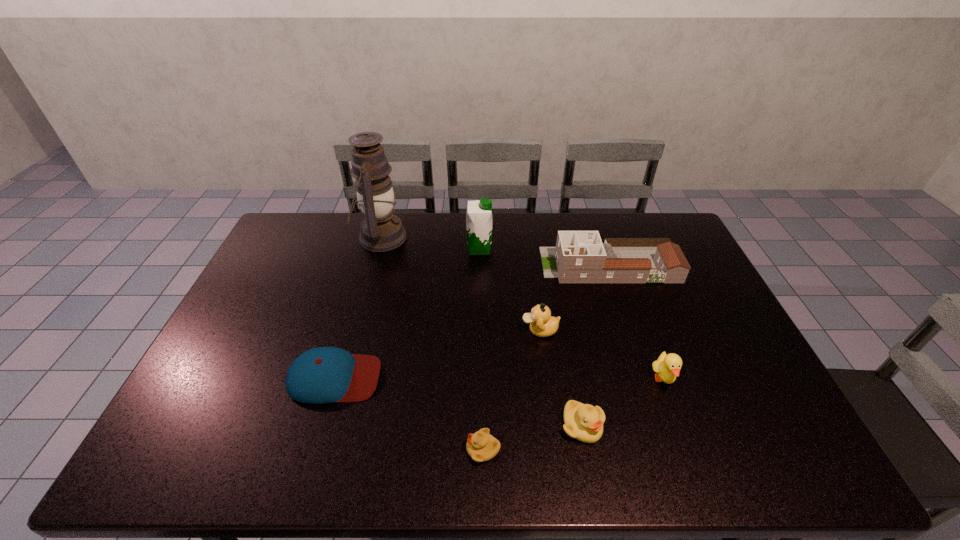
Identify the location of oil lamp. Image resolution: width=960 pixels, height=540 pixels. (381, 230).

Where is `the seventh shortest object`? This screenshot has width=960, height=540. the seventh shortest object is located at coordinates (479, 221).

At what (x,y) coordinates should I click in order to perform the action: click on the sixth shortest object. Please return your answer as a coordinate pair (x, y). Looking at the image, I should click on (579, 256).

Locate an element on the screen. This screenshot has width=960, height=540. the farthest duckling is located at coordinates (542, 324).

Find the location of a particular element. Image resolution: width=960 pixels, height=540 pixels. the second farthest duckling is located at coordinates (667, 367).

Locate an element on the screen. The width and height of the screenshot is (960, 540). the third tallest duckling is located at coordinates (584, 422).

Image resolution: width=960 pixels, height=540 pixels. What are the coordinates of `baseball cap` in the screenshot? It's located at (320, 375).

The image size is (960, 540). Find the location of `the shortest duckling`. the shortest duckling is located at coordinates (481, 446).

Find the location of a particular element. the leftmost duckling is located at coordinates (481, 446).

This screenshot has width=960, height=540. I want to click on vacant space located on the right of the tallest object, so click(505, 238).